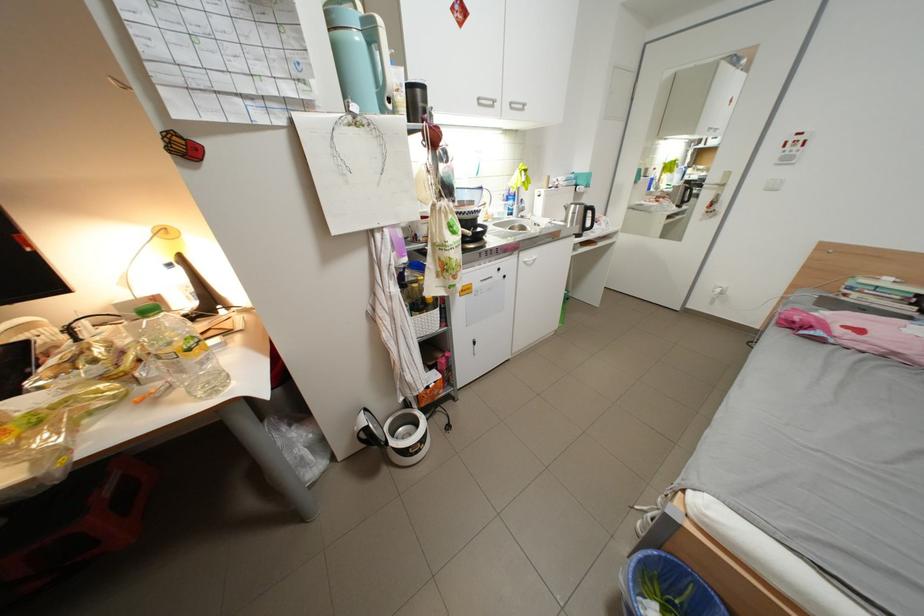
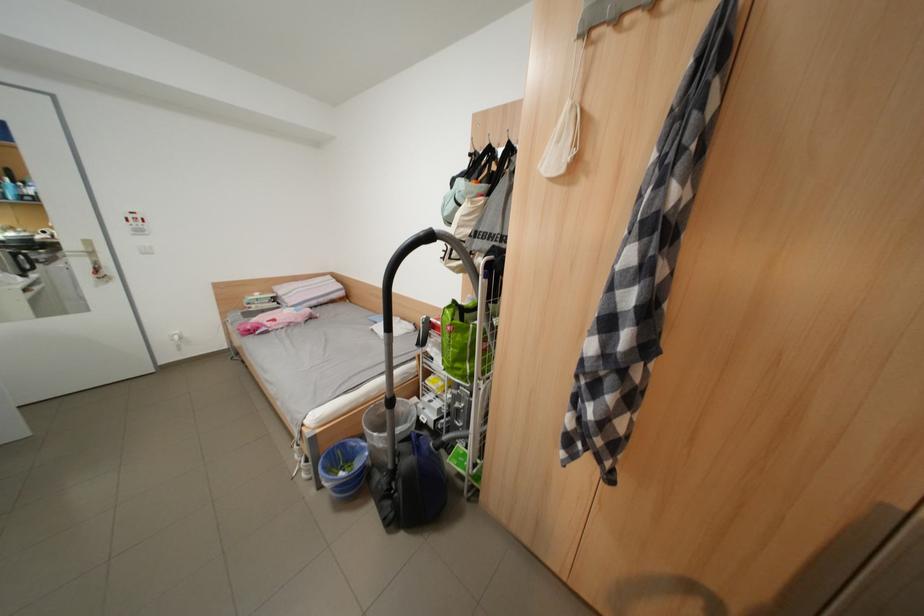
First-person continuous shooting, in which direction is the camera rotating?

The camera's rotation is toward right-down.